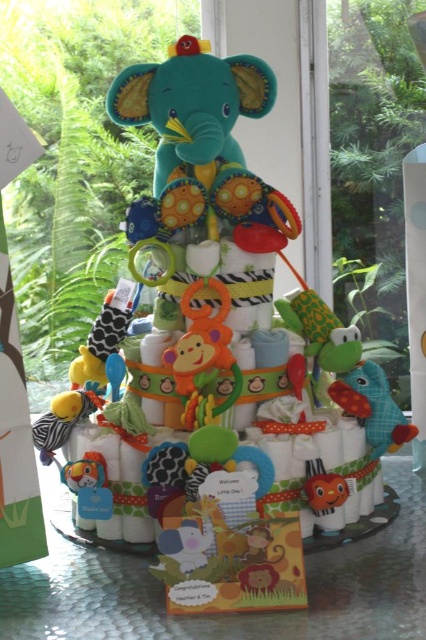
Consider the image. Who is lower down, yellow plush monkey at center or soft plush tiger at lower left?

Positioned lower is soft plush tiger at lower left.

Does yellow plush monkey at center have a lesser width compared to soft plush tiger at lower left?

No.

Who is more forward, (34, 438) or (69, 467)?

Point (69, 467) is in front.

I want to click on yellow plush monkey at center, so click(63, 419).

Does soft plush fish at center have a smaller size compared to soft plush tiger at lower left?

No, soft plush fish at center is not smaller than soft plush tiger at lower left.

Is point (371, 445) positioned before point (91, 508)?

No.

Is point (377, 385) farther from viewer compared to point (100, 492)?

Yes.

Locate an element on the screen. soft plush fish at center is located at coordinates [373, 406].

Is point (69, 477) farther from camera compared to point (319, 513)?

No, it is not.

Who is positioned more to the right, soft plush tiger at lower left or matte orange plush toy at center?

matte orange plush toy at center

Where is `soft plush tiger at lower left`? soft plush tiger at lower left is located at coordinates (89, 486).

Identify the location of soft plush tiger at lower left. The height and width of the screenshot is (640, 426). (89, 486).